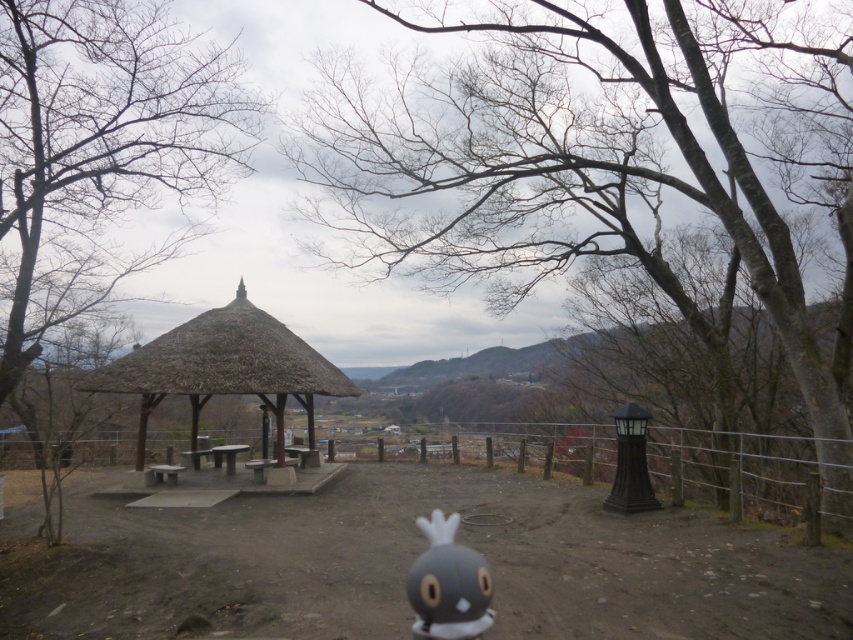
You are standing at the base of the hill and looking up at the wooden fence at center and the thatched wood gazebo at center. Which structure is higher up the hill?

The thatched wood gazebo at center is higher up the hill than the wooden fence at center because the wooden fence at center is below the thatched wood gazebo at center.

You are a hiker who wants to place the gray matte plush toy at center on top of the wooden fence at center. Can you do that?

The wooden fence at center might be wider than gray matte plush toy at center, so it is possible that the gray matte plush toy at center can be placed on top of the wooden fence at center. However, the exact feasibility depends on the actual width difference between the two objects.